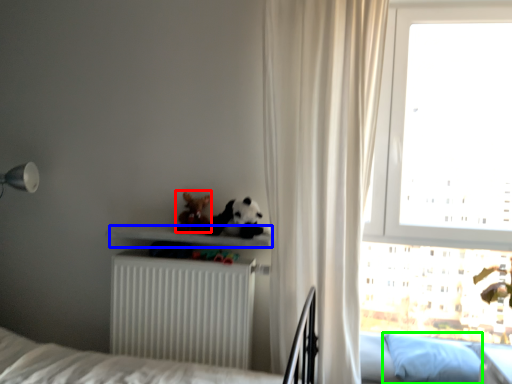
Question: Which object is positioned closest to miniature (highlighted by a red box)? Select from shelf (highlighted by a blue box) and pillow (highlighted by a green box).

Choices:
 (A) shelf
 (B) pillow

Answer: (A)